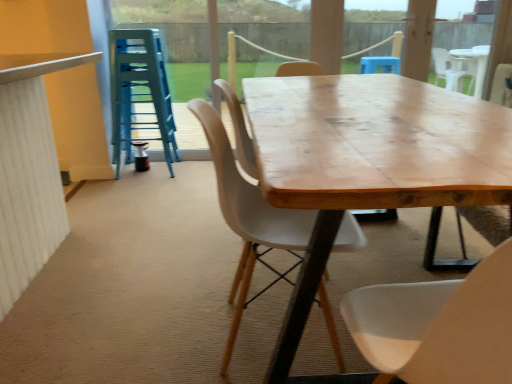
Question: Does transparent glass door at upper center have a lesser width compared to wooden chair at center?

Choices:
 (A) no
 (B) yes

Answer: (B)

Question: Can you confirm if transparent glass door at upper center is wider than wooden chair at center?

Choices:
 (A) yes
 (B) no

Answer: (B)

Question: Is transparent glass door at upper center outside of wooden chair at center?

Choices:
 (A) yes
 (B) no

Answer: (A)

Question: Could you tell me if transparent glass door at upper center is facing wooden chair at center?

Choices:
 (A) no
 (B) yes

Answer: (B)

Question: Is transparent glass door at upper center taller than wooden chair at center?

Choices:
 (A) yes
 (B) no

Answer: (A)

Question: Is transparent glass door at upper center further to the viewer compared to wooden chair at center?

Choices:
 (A) no
 (B) yes

Answer: (B)

Question: Is transparent glass door at upper center at the right side of blue plastic stool at left?

Choices:
 (A) yes
 (B) no

Answer: (A)

Question: From the image's perspective, is transparent glass door at upper center under blue plastic stool at left?

Choices:
 (A) no
 (B) yes

Answer: (A)

Question: Does transparent glass door at upper center have a lesser height compared to blue plastic stool at left?

Choices:
 (A) no
 (B) yes

Answer: (A)

Question: Would you say blue plastic stool at left is part of transparent glass door at upper center's contents?

Choices:
 (A) yes
 (B) no

Answer: (B)

Question: Is transparent glass door at upper center further to camera compared to blue plastic stool at left?

Choices:
 (A) yes
 (B) no

Answer: (A)

Question: From the image's perspective, is transparent glass door at upper center on top of blue plastic stool at left?

Choices:
 (A) no
 (B) yes

Answer: (B)

Question: Is wooden table at center oriented away from transparent glass door at upper center?

Choices:
 (A) yes
 (B) no

Answer: (B)